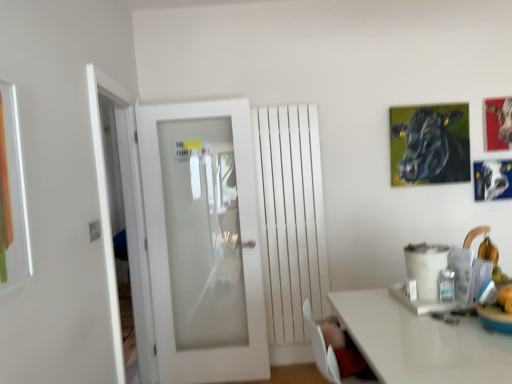
This screenshot has width=512, height=384. In order to click on vacant area on top of white matte radiator at center (from a real-world perspective) in this screenshot , I will do `click(278, 104)`.